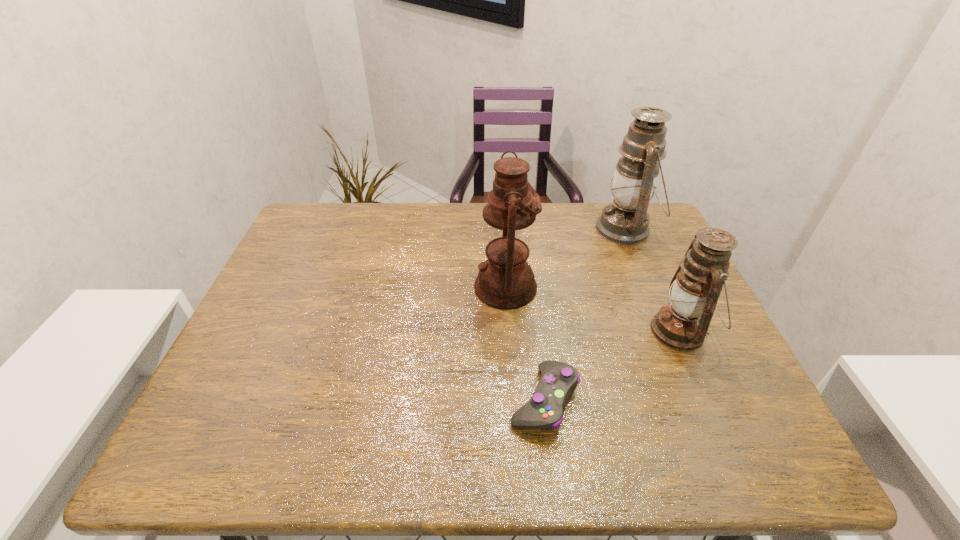
Find the location of `the second closest lantern to the shortest lantern`. the second closest lantern to the shortest lantern is located at coordinates (505, 280).

The height and width of the screenshot is (540, 960). Find the location of `blank space that satisfies the following two spatial constraints: 1. on the back side of the shortest lantern; 2. on the right side of the nearest object`. blank space that satisfies the following two spatial constraints: 1. on the back side of the shortest lantern; 2. on the right side of the nearest object is located at coordinates (x=536, y=331).

Identify the location of free space that satisfies the following two spatial constraints: 1. on the front side of the control; 2. on the right side of the leftmost lantern. The width and height of the screenshot is (960, 540). (513, 400).